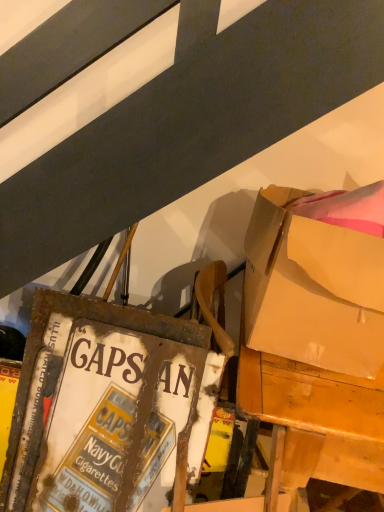
Question: Looking at their shapes, would you say matte cardboard box at upper right is wider or thinner than rusty metal signboard at lower left?

Choices:
 (A) thin
 (B) wide

Answer: (B)

Question: Is point (319, 270) positioned closer to the camera than point (137, 402)?

Choices:
 (A) closer
 (B) farther

Answer: (A)

Question: Based on their relative distances, which object is farther from the matte cardboard box at upper right?

Choices:
 (A) wooden desk at right
 (B) rusty metal signboard at lower left

Answer: (B)

Question: Considering the real-world distances, which object is farthest from the matte cardboard box at upper right?

Choices:
 (A) wooden desk at right
 (B) rusty metal signboard at lower left

Answer: (B)